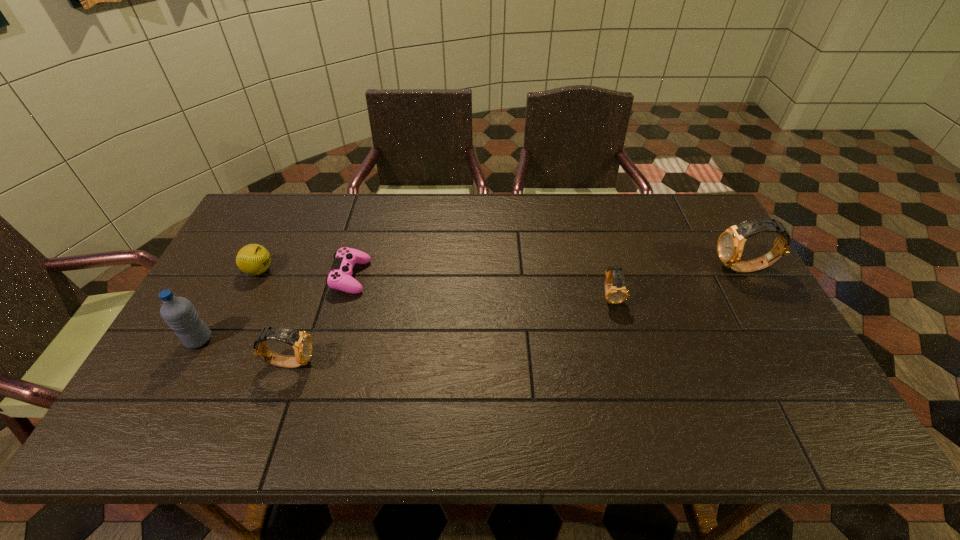
To achieve even spacing by inserting another watch among them, please point to a vacant spot for this new watch. Please provide its 2D coordinates. Your answer should be formatted as a tuple, i.e. [(x, y)], where the tuple contains the x and y coordinates of a point satisfying the conditions above.

[(461, 327)]